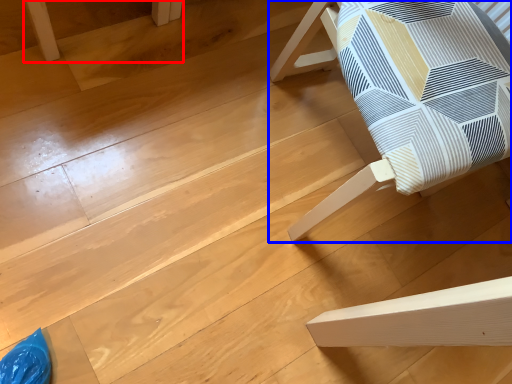
Question: Which point is further to the camera, furniture (highlighted by a red box) or furniture (highlighted by a blue box)?

Choices:
 (A) furniture
 (B) furniture

Answer: (A)